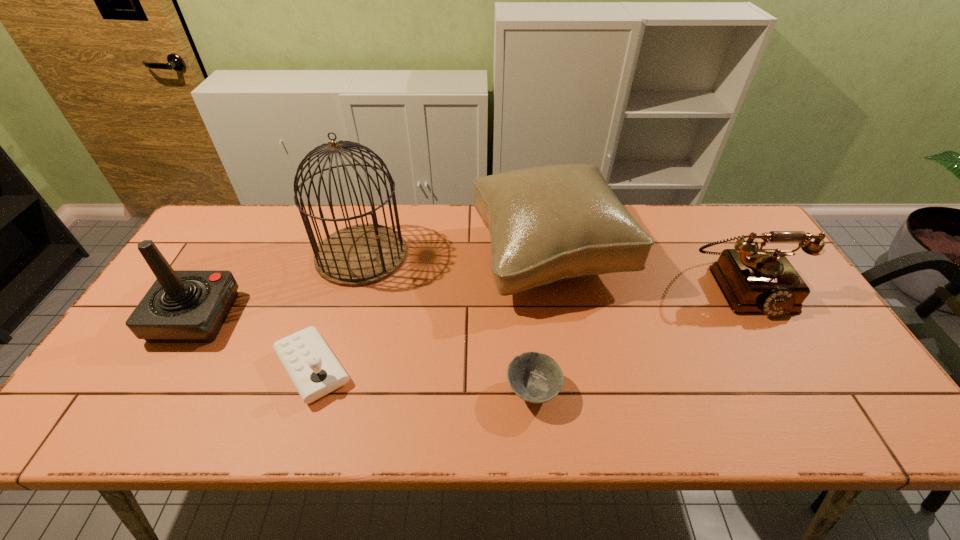
Locate an element on the screen. This screenshot has height=540, width=960. object situated at the right edge is located at coordinates (753, 281).

You are a GUI agent. You are given a task and a screenshot of the screen. Output one action in this format:
    pyautogui.click(x=<x>, y=<y>)
    Task: Click on the vacant area at the far edge of the desktop
    The image size is (960, 540).
    Given the screenshot: What is the action you would take?
    pyautogui.click(x=457, y=210)

In the image, there is a desktop. Where is `free region at the near edge`? The height and width of the screenshot is (540, 960). free region at the near edge is located at coordinates (277, 432).

You are a GUI agent. You are given a task and a screenshot of the screen. Output one action in this format:
    pyautogui.click(x=<x>, y=<y>)
    Task: Click on the vacant space at the left edge of the desktop
    The image size is (960, 540).
    Given the screenshot: What is the action you would take?
    pyautogui.click(x=198, y=253)

Find the location of a particular element. The width and height of the screenshot is (960, 540). vacant space at the right edge of the desktop is located at coordinates (845, 395).

In the image, there is a desktop. At what (x,y) coordinates should I click in order to perform the action: click on free region at the far left corner. Please return your answer as a coordinate pair (x, y). Image resolution: width=960 pixels, height=540 pixels. Looking at the image, I should click on (224, 215).

I want to click on vacant space at the near left corner, so click(x=133, y=402).

The width and height of the screenshot is (960, 540). In the image, there is a desktop. In order to click on vacant region at the far right corner in this screenshot , I will do `click(725, 221)`.

You are a GUI agent. You are given a task and a screenshot of the screen. Output one action in this format:
    pyautogui.click(x=<x>, y=<y>)
    Task: Click on the vacant space that's between the taller joystick and the shortest object
    This screenshot has height=540, width=960.
    Given the screenshot: What is the action you would take?
    coord(364,354)

The image size is (960, 540). I want to click on vacant area that lies between the cushion and the bowl, so click(x=541, y=323).